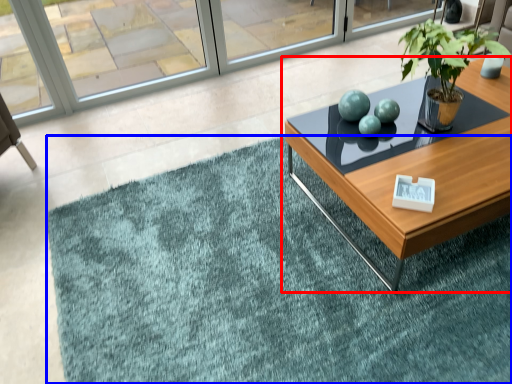
Question: Which object appears farthest to the camera in this image, coffee table (highlighted by a red box) or doormat (highlighted by a blue box)?

Choices:
 (A) coffee table
 (B) doormat

Answer: (A)